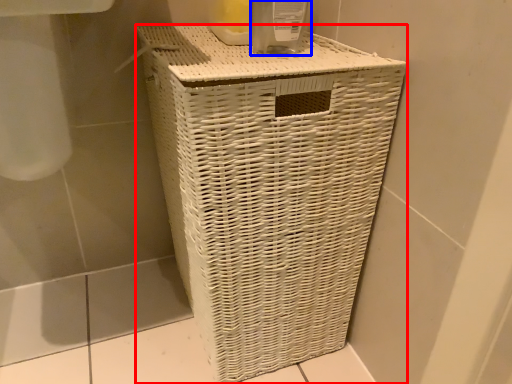
Question: Which object is further to the camera taking this photo, waste container (highlighted by a red box) or glass jar (highlighted by a blue box)?

Choices:
 (A) waste container
 (B) glass jar

Answer: (B)